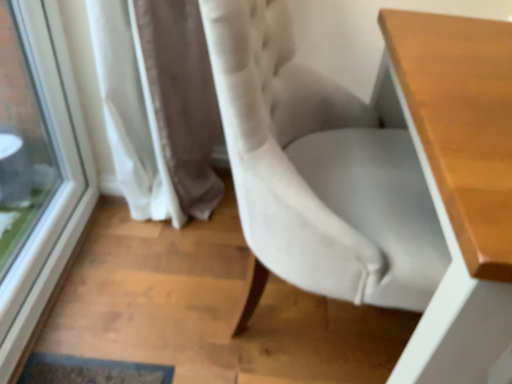
Question: Is transparent glass window at left wider than wooden table at right?

Choices:
 (A) yes
 (B) no

Answer: (B)

Question: From a real-world perspective, is transparent glass window at left below wooden table at right?

Choices:
 (A) no
 (B) yes

Answer: (A)

Question: Is wooden table at right surrounded by transparent glass window at left?

Choices:
 (A) no
 (B) yes

Answer: (A)

Question: From the image's perspective, is transparent glass window at left on top of wooden table at right?

Choices:
 (A) no
 (B) yes

Answer: (B)

Question: Is transparent glass window at left in front of wooden table at right?

Choices:
 (A) no
 (B) yes

Answer: (A)

Question: Is wooden table at right situated inside transparent glass window at left or outside?

Choices:
 (A) outside
 (B) inside

Answer: (A)

Question: Is point (486, 82) positioned closer to the camera than point (70, 145)?

Choices:
 (A) closer
 (B) farther

Answer: (A)

Question: Is wooden table at right bigger or smaller than transparent glass window at left?

Choices:
 (A) small
 (B) big

Answer: (B)

Question: Considering the positions of wooden table at right and transparent glass window at left in the image, is wooden table at right taller or shorter than transparent glass window at left?

Choices:
 (A) short
 (B) tall

Answer: (B)

Question: From the image's perspective, relative to transparent glass window at left, is velvet white chair at center above or below?

Choices:
 (A) below
 (B) above

Answer: (A)

Question: In terms of width, does velvet white chair at center look wider or thinner when compared to transparent glass window at left?

Choices:
 (A) wide
 (B) thin

Answer: (A)

Question: Is velvet white chair at center taller or shorter than transparent glass window at left?

Choices:
 (A) tall
 (B) short

Answer: (A)

Question: Considering the positions of velvet white chair at center and transparent glass window at left in the image, is velvet white chair at center bigger or smaller than transparent glass window at left?

Choices:
 (A) big
 (B) small

Answer: (A)

Question: Do you think velvet white chair at center is within white textured curtain at lower left, or outside of it?

Choices:
 (A) outside
 (B) inside

Answer: (A)

Question: Would you say velvet white chair at center is to the left or to the right of white textured curtain at lower left in the picture?

Choices:
 (A) right
 (B) left

Answer: (A)